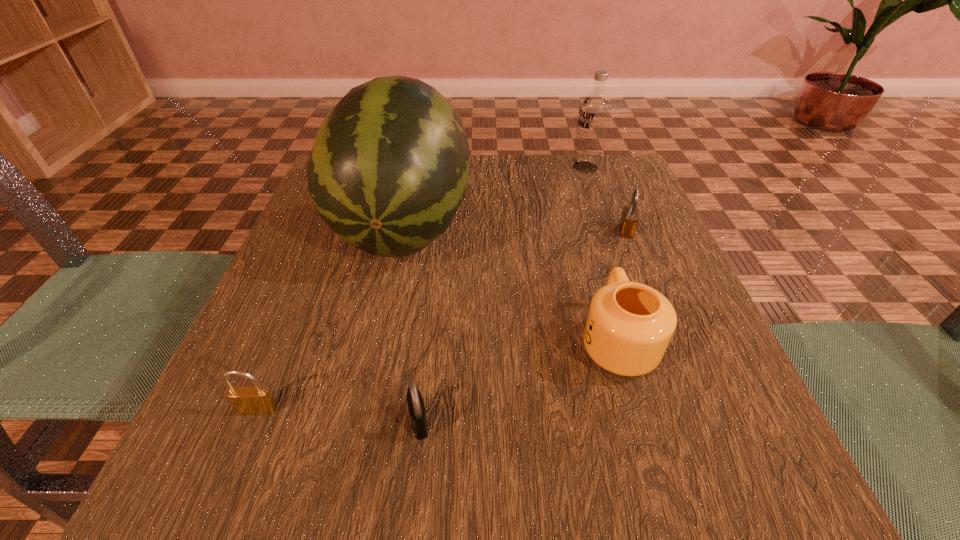
You are a GUI agent. You are given a task and a screenshot of the screen. Output one action in this format:
    pyautogui.click(x=<x>, y=<y>)
    Task: Click on the free spot located on the front label of the vodka
    The width and height of the screenshot is (960, 540).
    Given the screenshot: What is the action you would take?
    pyautogui.click(x=424, y=167)

Find the location of a particular element. vacant space located 0.320m on the front label of the vodka is located at coordinates (441, 167).

The image size is (960, 540). In order to click on vacant space located 0.390m on the handle side of the third tallest object in this screenshot , I will do (571, 183).

Where is `free space located on the handle side of the third tallest object`? The width and height of the screenshot is (960, 540). free space located on the handle side of the third tallest object is located at coordinates (582, 221).

You are a GUI agent. You are given a task and a screenshot of the screen. Output one action in this format:
    pyautogui.click(x=<x>, y=<y>)
    Task: Click on the vacant space situated 0.050m on the handle side of the third tallest object
    
    Given the screenshot: What is the action you would take?
    pyautogui.click(x=600, y=284)

The width and height of the screenshot is (960, 540). Find the location of `vacant space located on the front of the farthest padlock`. vacant space located on the front of the farthest padlock is located at coordinates (703, 424).

Locate an element on the screen. The height and width of the screenshot is (540, 960). blank space located 0.200m on the back of the second padlock from right to left is located at coordinates (432, 300).

At what (x,y) coordinates should I click in order to perform the action: click on watermelon at the far edge. Please return your answer as a coordinate pair (x, y). The height and width of the screenshot is (540, 960). Looking at the image, I should click on (388, 171).

Find the location of a particular element. This screenshot has width=960, height=540. vodka that is at the far edge is located at coordinates (595, 108).

Identify the location of object situated at the near edge. (416, 407).